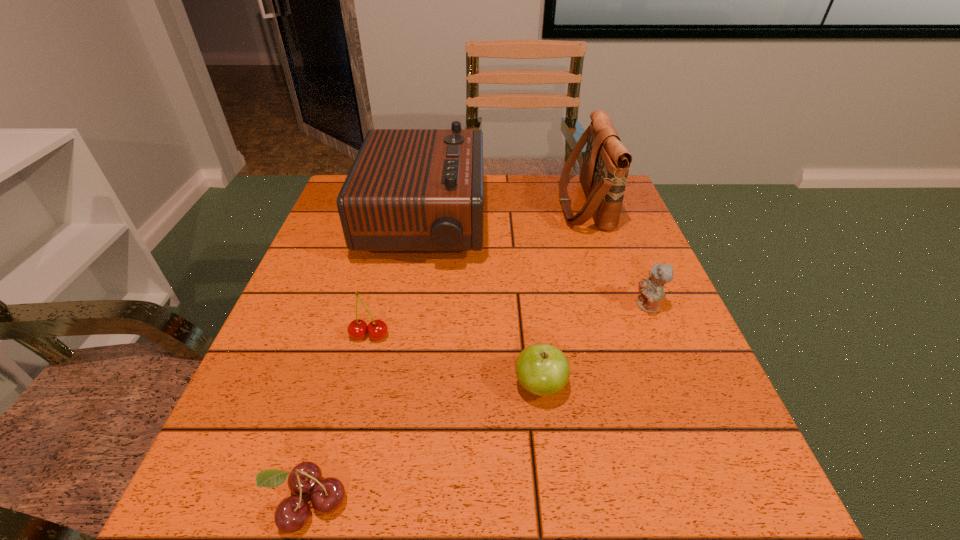
In order to click on shoulder bag in this screenshot , I will do `click(606, 163)`.

Find the location of a particular element. Image resolution: width=960 pixels, height=540 pixels. radio receiver is located at coordinates (408, 190).

The width and height of the screenshot is (960, 540). Find the location of `teddy bear`. teddy bear is located at coordinates (651, 290).

Identify the location of the second nearest object. (542, 369).

This screenshot has height=540, width=960. I want to click on the third object from right to left, so click(x=542, y=369).

You are a GUI agent. You are given a task and a screenshot of the screen. Output one action in this format:
    pyautogui.click(x=<x>, y=<y>)
    Task: Click on the third nearest object
    The image size is (960, 540).
    Given the screenshot: What is the action you would take?
    pyautogui.click(x=377, y=329)

Where is `the nearer cherry`? The width and height of the screenshot is (960, 540). the nearer cherry is located at coordinates (327, 495).

You are a GUI agent. You are given a task and a screenshot of the screen. Output one action in this format:
    pyautogui.click(x=<x>, y=<y>)
    Task: Click on the free space located on the front-facing side of the shoulder bag
    
    Given the screenshot: What is the action you would take?
    pyautogui.click(x=468, y=204)

The width and height of the screenshot is (960, 540). I want to click on free space located on the front-facing side of the shoulder bag, so click(471, 204).

Identify the location of vacant region located on the front-facing side of the shoulder bag. This screenshot has width=960, height=540. (453, 204).